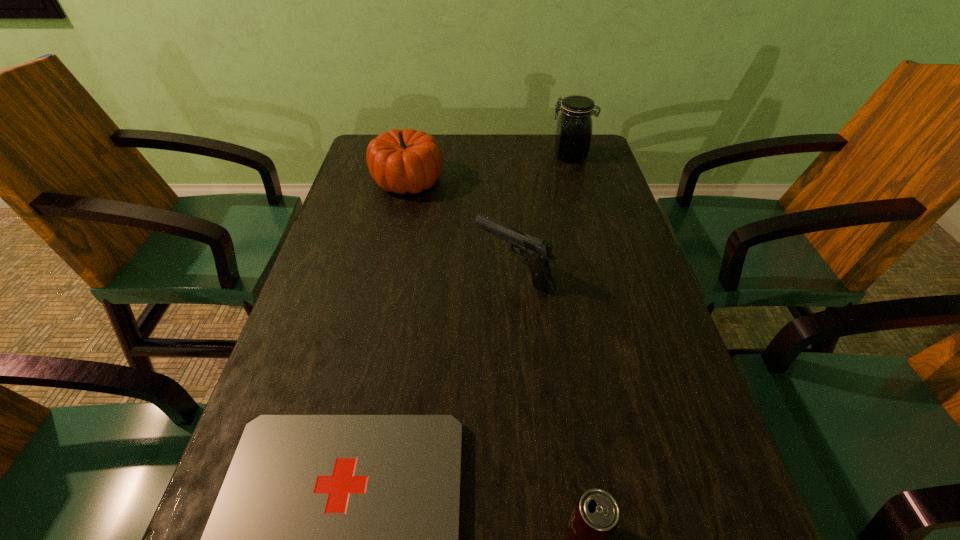
Where is `free point between the pumpkin and the rightmost object`? This screenshot has height=540, width=960. free point between the pumpkin and the rightmost object is located at coordinates (489, 168).

Locate an element on the screen. free space between the gun and the tallest object is located at coordinates (x=542, y=215).

The image size is (960, 540). Find the location of `vacant area that lies between the gun and the pumpkin`. vacant area that lies between the gun and the pumpkin is located at coordinates (461, 227).

This screenshot has width=960, height=540. In order to click on unoccupied area between the third farthest object and the pumpkin in this screenshot , I will do `click(461, 227)`.

Identify which object is located as the fourth nearest to the rightmost object. Please provide its 2D coordinates. Your answer should be formatted as a tuple, i.e. [(x, y)], where the tuple contains the x and y coordinates of a point satisfying the conditions above.

[(595, 517)]

The width and height of the screenshot is (960, 540). What are the coordinates of `object that is the fourth closest one to the pumpkin` in the screenshot? It's located at (595, 517).

Find the location of a particular element. vacant space that satisfies the following two spatial constraints: 1. on the lid of the tallest object; 2. on the front side of the pumpkin is located at coordinates (577, 180).